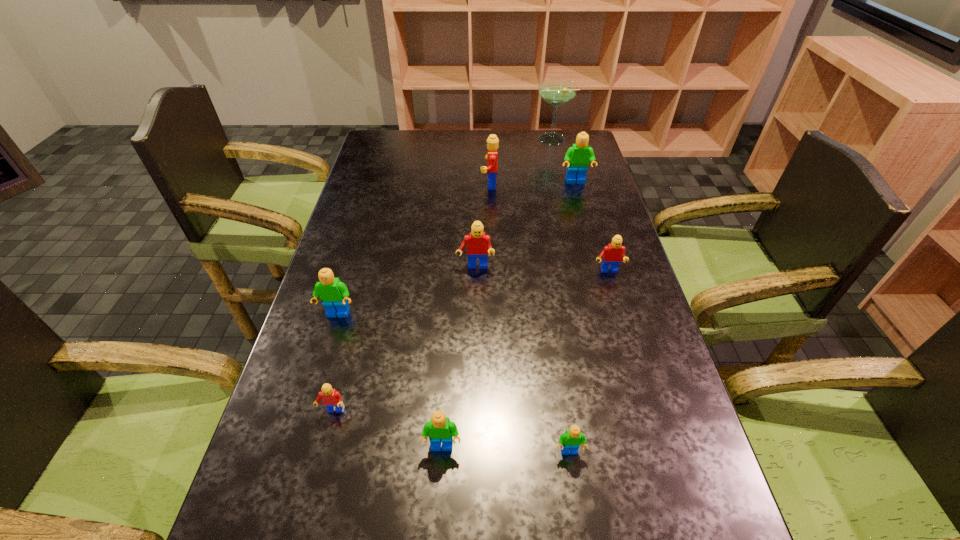
Image resolution: width=960 pixels, height=540 pixels. I want to click on free space between the second green Lego from left to right and the third smallest red Lego, so click(459, 357).

The image size is (960, 540). Find the location of `free area in between the martini and the second smallest green Lego`. free area in between the martini and the second smallest green Lego is located at coordinates point(496,293).

This screenshot has width=960, height=540. I want to click on the second closest object relative to the tallest object, so click(x=492, y=145).

The width and height of the screenshot is (960, 540). Identify the location of object that stands as the fifth closest to the third green Lego from right to left. (612, 254).

Identify which Lego is located as the second nearest to the farthest red Lego. Please provide its 2D coordinates. Your answer should be formatted as a tuple, i.e. [(x, y)], where the tuple contains the x and y coordinates of a point satisfying the conditions above.

[(478, 243)]

I want to click on Lego that is the sixth closest to the rightmost red Lego, so click(334, 294).

You are a GUI agent. You are given a task and a screenshot of the screen. Output one action in this format:
    pyautogui.click(x=<x>, y=<y>)
    Task: Click on the red Lego that is the fourth closest to the smallest green Lego
    This screenshot has width=960, height=540.
    Given the screenshot: What is the action you would take?
    pyautogui.click(x=492, y=145)

Locate an element on the screen. the third closest red Lego to the second biggest red Lego is located at coordinates (331, 397).

This screenshot has height=540, width=960. What are the coordinates of `green Lego that is the closest to the third nearest green Lego` in the screenshot? It's located at (440, 429).

Point out which green Lego is positioned as the nearest to the second smallest green Lego. Please provide its 2D coordinates. Your answer should be formatted as a tuple, i.e. [(x, y)], where the tuple contains the x and y coordinates of a point satisfying the conditions above.

[(571, 440)]